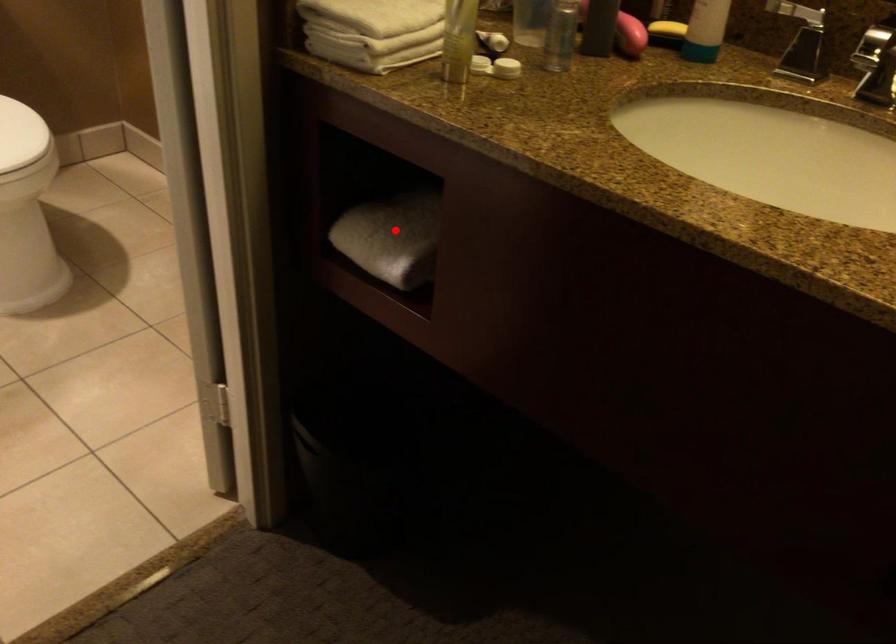
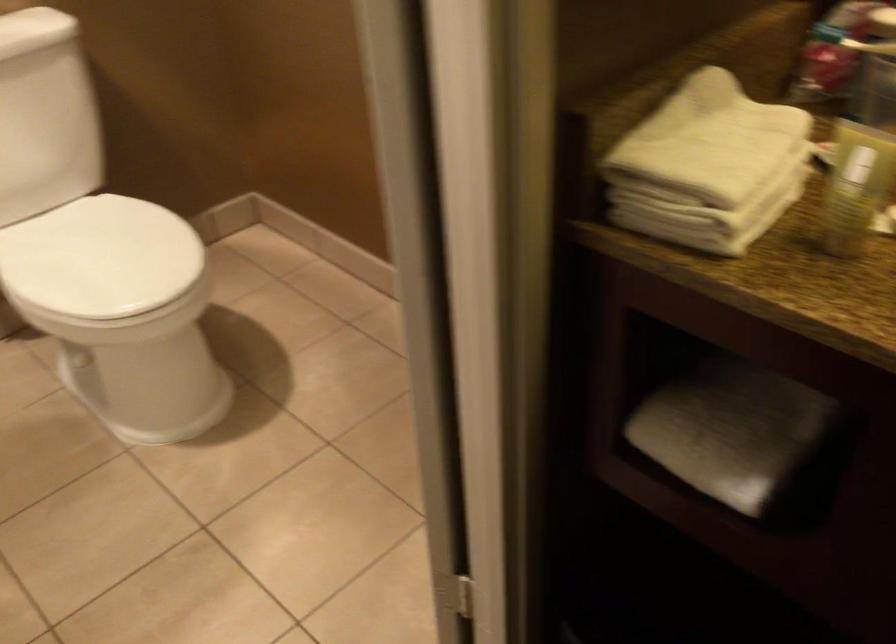
Question: I am providing you with two images of the same scene from different viewpoints. A red point is shown in image1. For the corresponding object point in image2, is it positioned nearer or farther from the camera?

Choices:
 (A) Nearer
 (B) Farther

Answer: (A)